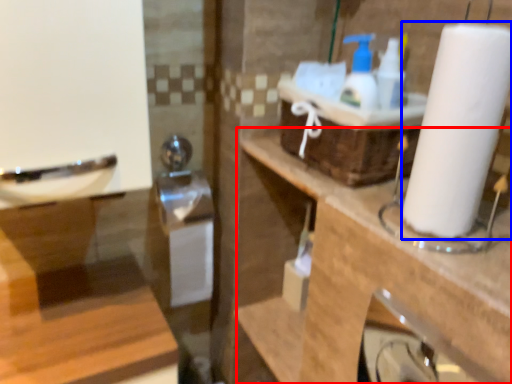
Question: Which point is further to the camera, counter top (highlighted by a red box) or paper towel (highlighted by a blue box)?

Choices:
 (A) counter top
 (B) paper towel

Answer: (A)